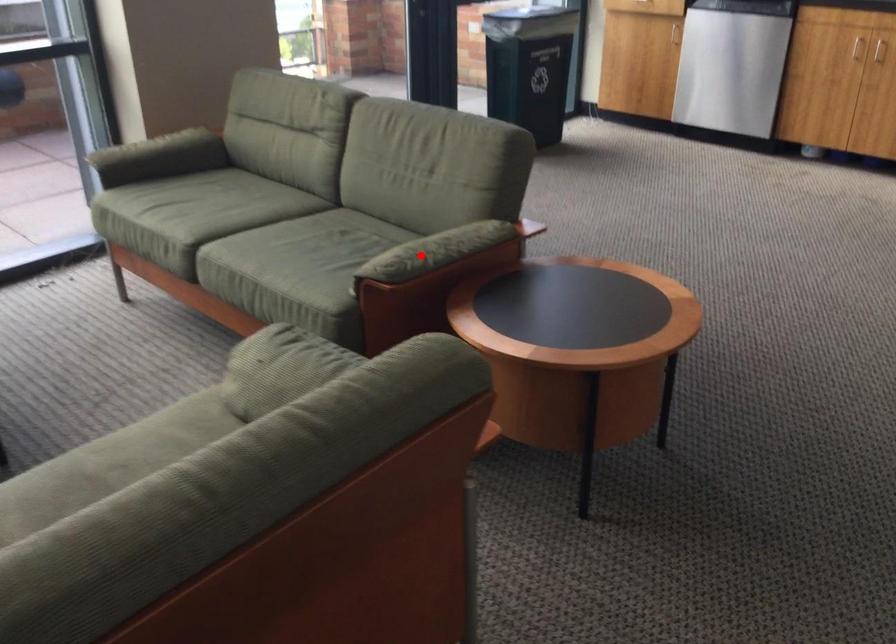
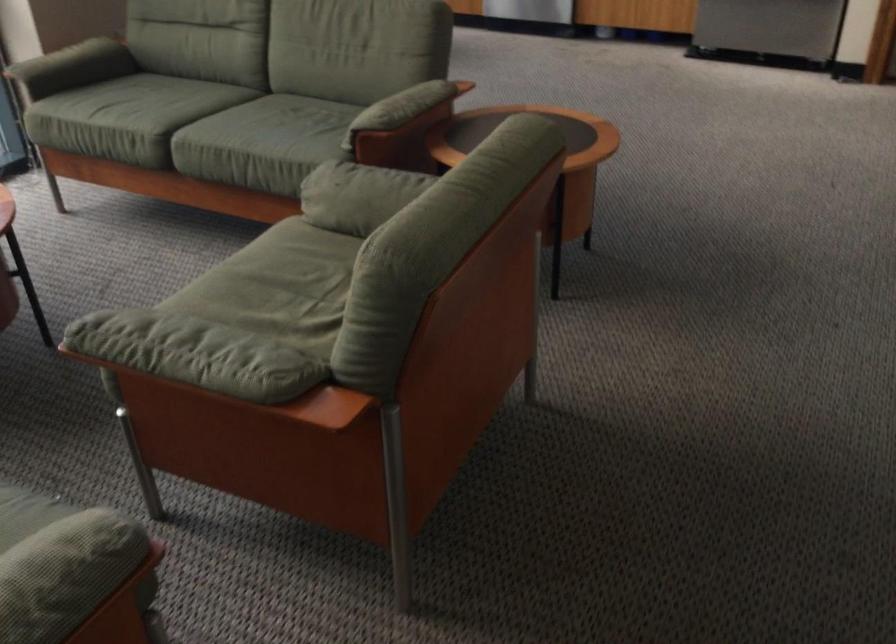
Question: A red point is marked in image1. In image2, is the corresponding 3D point closer to the camera or farther? Reply with the corresponding letter.

Choices:
 (A) The corresponding 3D point is closer.
 (B) The corresponding 3D point is farther.

Answer: (B)